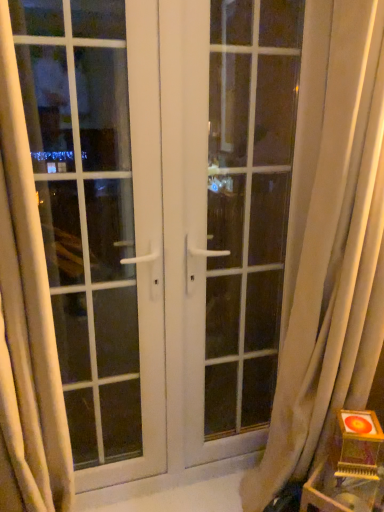
Question: Could you tell me if white sheer curtain at left, placed as the second curtain when sorted from right to left, is facing white glossy door at center?

Choices:
 (A) no
 (B) yes

Answer: (A)

Question: Is white sheer curtain at left, the 1th curtain viewed from the left, not within white glossy door at center?

Choices:
 (A) yes
 (B) no

Answer: (A)

Question: From the image's perspective, would you say white sheer curtain at left, placed as the second curtain when sorted from right to left, is shown under white glossy door at center?

Choices:
 (A) no
 (B) yes

Answer: (B)

Question: Is white sheer curtain at left, the 1th curtain viewed from the left, wider than white glossy door at center?

Choices:
 (A) no
 (B) yes

Answer: (B)

Question: Is white sheer curtain at left, placed as the second curtain when sorted from right to left, further to camera compared to white glossy door at center?

Choices:
 (A) yes
 (B) no

Answer: (B)

Question: Is white sheer curtain at left, placed as the second curtain when sorted from right to left, to the right of white glossy door at center from the viewer's perspective?

Choices:
 (A) yes
 (B) no

Answer: (B)

Question: Is white glossy door at center further to the viewer compared to wooden table at lower right?

Choices:
 (A) no
 (B) yes

Answer: (B)

Question: From a real-world perspective, is white glossy door at center on wooden table at lower right?

Choices:
 (A) yes
 (B) no

Answer: (A)

Question: Can you confirm if white glossy door at center is shorter than wooden table at lower right?

Choices:
 (A) no
 (B) yes

Answer: (A)

Question: Does white glossy door at center have a smaller size compared to wooden table at lower right?

Choices:
 (A) no
 (B) yes

Answer: (A)

Question: Does white glossy door at center lie in front of wooden table at lower right?

Choices:
 (A) no
 (B) yes

Answer: (A)

Question: Is white glossy door at center not close to wooden table at lower right?

Choices:
 (A) no
 (B) yes

Answer: (A)

Question: From a real-world perspective, is white glass window at center under wooden table at lower right?

Choices:
 (A) yes
 (B) no

Answer: (B)